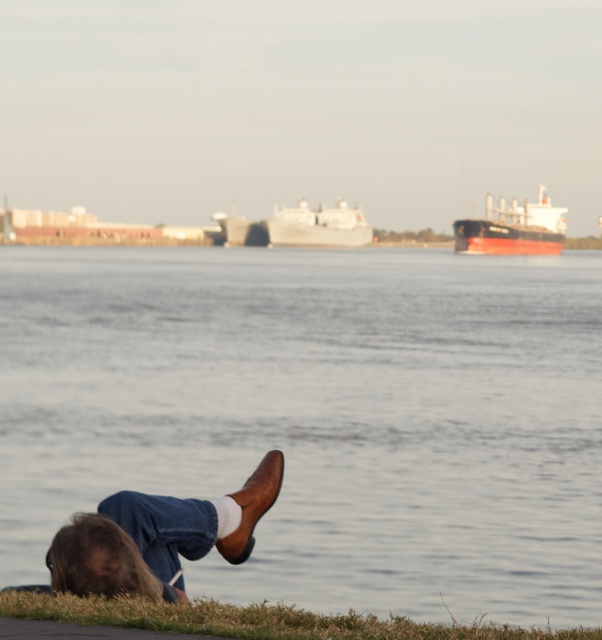
Locate an element on the screen. clear water at lower center is located at coordinates (320, 417).

Find the location of a particular element. This screenshot has height=640, width=602. clear water at lower center is located at coordinates (320, 417).

Describe the element at coordinates (320, 417) in the screenshot. I see `clear water at lower center` at that location.

Between clear water at lower center and red matte cargo ship at upper center, which one appears on the left side from the viewer's perspective?

clear water at lower center is more to the left.

Does point (305, 513) come farther from viewer compared to point (532, 220)?

No, (305, 513) is in front of (532, 220).

At what (x,y) coordinates should I click in order to perform the action: click on clear water at lower center. Please return your answer as a coordinate pair (x, y). Image resolution: width=602 pixels, height=640 pixels. Looking at the image, I should click on (320, 417).

Who is more forward, [11,396] or [296,220]?

Positioned in front is point [11,396].

Can you confirm if clear water at lower center is bigger than gray matte ship at center?

Yes.

This screenshot has width=602, height=640. Find the location of `clear water at lower center`. clear water at lower center is located at coordinates (320, 417).

What are the coordinates of `clear water at lower center` in the screenshot? It's located at (320, 417).